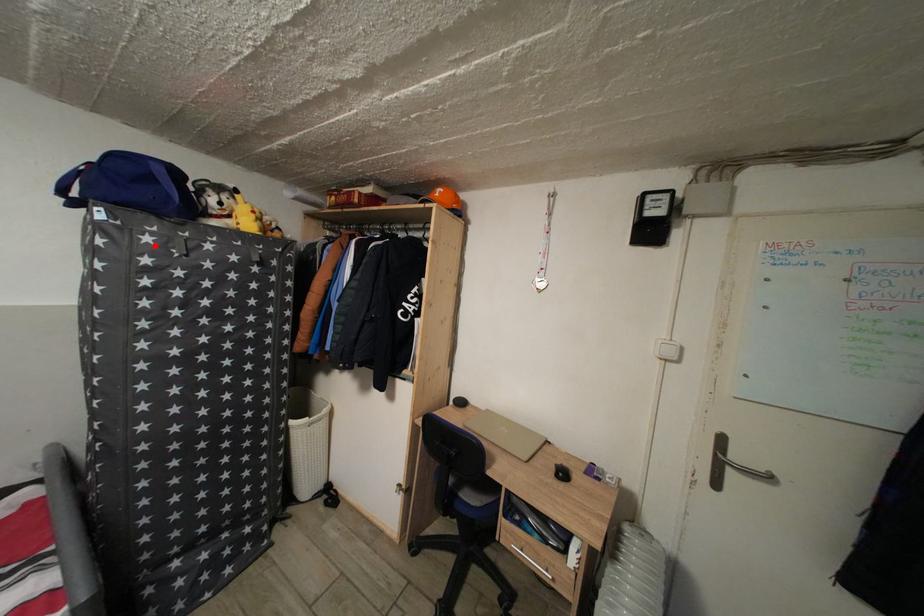
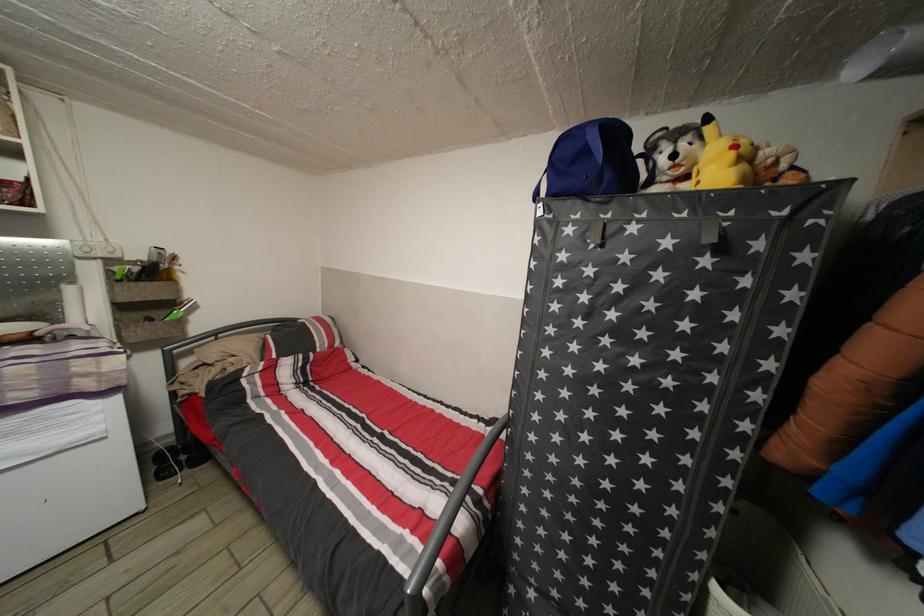
In the second image, find the point that corresponds to the highlighted location in the first image.

(576, 237)